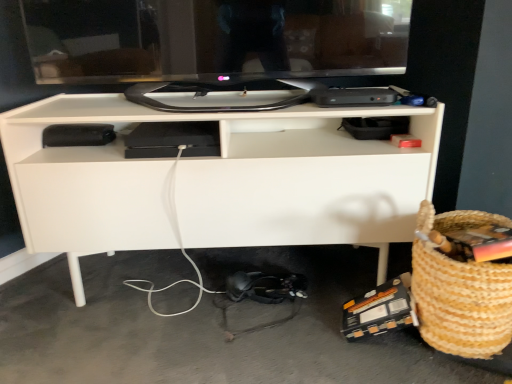
Where is `white matte desk at center`? white matte desk at center is located at coordinates (217, 181).

This screenshot has width=512, height=384. I want to click on black glossy monitor at upper center, so click(x=213, y=38).

Considering the relative sizes of braided straw basket at lower right and black glossy monitor at upper center in the image provided, is braided straw basket at lower right wider than black glossy monitor at upper center?

Indeed, braided straw basket at lower right has a greater width compared to black glossy monitor at upper center.

This screenshot has height=384, width=512. I want to click on basket lying on the right of black glossy monitor at upper center, so click(461, 303).

Are braided straw basket at lower right and black glossy monitor at upper center making contact?

braided straw basket at lower right and black glossy monitor at upper center are not in contact.

Which is farther from the camera, (338,236) or (369,31)?

The point (338,236) is more distant.

Is white matte desk at center far away from black glossy monitor at upper center?

Actually, white matte desk at center and black glossy monitor at upper center are a little close together.

Would you say white matte desk at center is outside black glossy monitor at upper center?

Yes, white matte desk at center is outside of black glossy monitor at upper center.

What's the angular difference between white matte desk at center and black glossy monitor at upper center's facing directions?

white matte desk at center and black glossy monitor at upper center are facing 2.35 degrees away from each other.

From a real-world perspective, which object rests below the other?

braided straw basket at lower right, from a real-world perspective.

Does point (472, 279) lie in front of point (248, 141)?

Yes, point (472, 279) is in front of point (248, 141).

Locate an element on the screen. This screenshot has height=384, width=512. desk above the braided straw basket at lower right (from a real-world perspective) is located at coordinates (217, 181).

Between black glossy monitor at upper center and white matte desk at center, which one has less height?

black glossy monitor at upper center is shorter.

From the image's perspective, which one is positioned higher, black glossy monitor at upper center or white matte desk at center?

black glossy monitor at upper center, from the image's perspective.

Considering the relative sizes of black glossy monitor at upper center and white matte desk at center in the image provided, is black glossy monitor at upper center smaller than white matte desk at center?

Correct, black glossy monitor at upper center occupies less space than white matte desk at center.

Could you tell me if white matte desk at center is facing braided straw basket at lower right?

Yes.

Considering the sizes of objects white matte desk at center and braided straw basket at lower right in the image provided, who is shorter, white matte desk at center or braided straw basket at lower right?

Standing shorter between the two is braided straw basket at lower right.

Considering the relative positions of white matte desk at center and braided straw basket at lower right in the image provided, is white matte desk at center behind braided straw basket at lower right?

Yes, white matte desk at center is further from the viewer.

In the scene shown: Which object is closer to the camera taking this photo, black glossy monitor at upper center or braided straw basket at lower right?

braided straw basket at lower right is closer to the camera.

Does black glossy monitor at upper center have a lesser width compared to braided straw basket at lower right?

Yes, black glossy monitor at upper center is thinner than braided straw basket at lower right.

From a real-world perspective, which object stands above the other?

black glossy monitor at upper center, from a real-world perspective.

Can we say black glossy monitor at upper center lies outside braided straw basket at lower right?

Yes.

Identify the location of basket on the right of black glossy monitor at upper center. The width and height of the screenshot is (512, 384). pyautogui.click(x=461, y=303).

Identify the location of computer monitor above the white matte desk at center (from the image's perspective). (213, 38).

When comparing their distances from black glossy monitor at upper center, does white matte desk at center or braided straw basket at lower right seem further?

Among the two, braided straw basket at lower right is located further to black glossy monitor at upper center.

From the image, which object appears to be nearer to braided straw basket at lower right, white matte desk at center or black glossy monitor at upper center?

white matte desk at center is closer to braided straw basket at lower right.

From the image, which object appears to be nearer to braided straw basket at lower right, black glossy monitor at upper center or white matte desk at center?

Based on the image, white matte desk at center appears to be nearer to braided straw basket at lower right.

When comparing their distances from white matte desk at center, does black glossy monitor at upper center or braided straw basket at lower right seem closer?

Among the two, black glossy monitor at upper center is located nearer to white matte desk at center.

From the image, which object appears to be nearer to white matte desk at center, braided straw basket at lower right or black glossy monitor at upper center?

black glossy monitor at upper center is closer to white matte desk at center.

Based on their spatial positions, is braided straw basket at lower right or white matte desk at center closer to black glossy monitor at upper center?

white matte desk at center.

The width and height of the screenshot is (512, 384). I want to click on desk between black glossy monitor at upper center and braided straw basket at lower right in the horizontal direction, so click(217, 181).